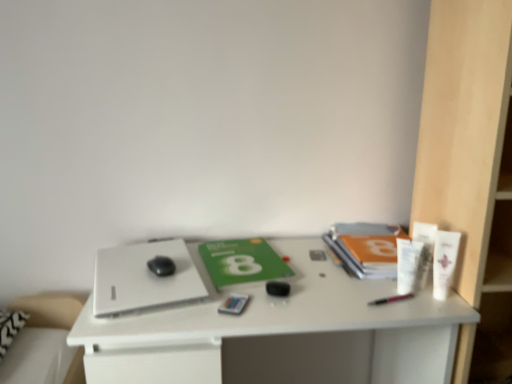
Locate an element on the screen. unoccupied region to the right of white matte laptop at left is located at coordinates (260, 283).